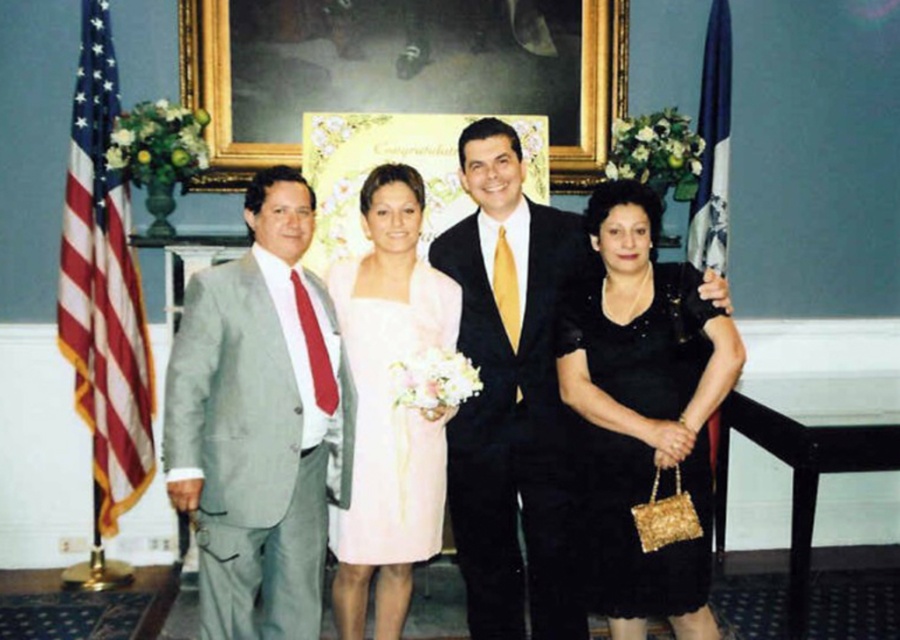
Question: Which point is farther to the camera?

Choices:
 (A) light gray suit at left
 (B) pink satin dress at center
 (C) black satin dress at center
 (D) goldwooden frame at upper center

Answer: (D)

Question: Is shiny black suit at center behind black satin dress at center?

Choices:
 (A) yes
 (B) no

Answer: (A)

Question: Considering the relative positions of red-white striped fabric at left and blue fabric flag at right in the image provided, where is red-white striped fabric at left located with respect to blue fabric flag at right?

Choices:
 (A) above
 (B) below

Answer: (B)

Question: Which of the following is the farthest from the observer?

Choices:
 (A) shiny black suit at center
 (B) black satin dress at center
 (C) pink satin dress at center
 (D) blue fabric flag at right

Answer: (D)

Question: Is the position of red-white striped fabric at left more distant than that of pink satin dress at center?

Choices:
 (A) yes
 (B) no

Answer: (A)

Question: Among these points, which one is nearest to the camera?

Choices:
 (A) (576, 289)
 (B) (555, 540)
 (C) (396, 433)
 (D) (689, 250)

Answer: (C)